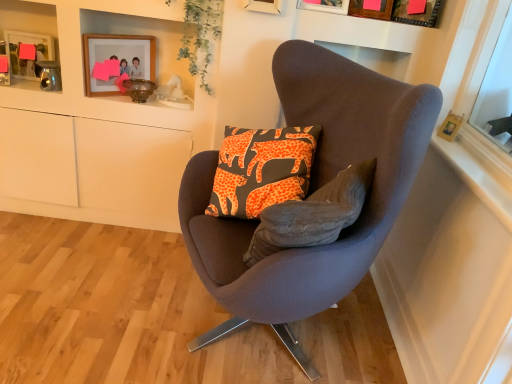
Question: Is brushed metal picture frame at upper left, which appears as the fifth picture frame when viewed from the right, next to suede-like brown chair at center and touching it?

Choices:
 (A) no
 (B) yes

Answer: (A)

Question: Considering the relative sizes of brushed metal picture frame at upper left, acting as the first picture frame starting from the left, and suede-like brown chair at center in the image provided, is brushed metal picture frame at upper left, acting as the first picture frame starting from the left, smaller than suede-like brown chair at center?

Choices:
 (A) yes
 (B) no

Answer: (A)

Question: Is brushed metal picture frame at upper left, which appears as the fifth picture frame when viewed from the right, taller than suede-like brown chair at center?

Choices:
 (A) no
 (B) yes

Answer: (A)

Question: Could you tell me if brushed metal picture frame at upper left, acting as the first picture frame starting from the left, is turned towards suede-like brown chair at center?

Choices:
 (A) no
 (B) yes

Answer: (A)

Question: From the image's perspective, is brushed metal picture frame at upper left, which appears as the fifth picture frame when viewed from the right, below suede-like brown chair at center?

Choices:
 (A) yes
 (B) no

Answer: (B)

Question: From their relative heights in the image, would you say wooden picture frame at upper center, the 4th picture frame positioned from the left, is taller or shorter than wooden frame at upper right?

Choices:
 (A) short
 (B) tall

Answer: (B)

Question: From a real-world perspective, is wooden picture frame at upper center, positioned as the 2th picture frame in right-to-left order, positioned above or below wooden frame at upper right?

Choices:
 (A) below
 (B) above

Answer: (B)

Question: Is point (364, 0) positioned closer to the camera than point (432, 135)?

Choices:
 (A) farther
 (B) closer

Answer: (A)

Question: Looking at the image, does wooden picture frame at upper center, positioned as the 2th picture frame in right-to-left order, seem bigger or smaller compared to wooden frame at upper right?

Choices:
 (A) big
 (B) small

Answer: (B)

Question: Does point (510, 223) appear closer or farther from the camera than point (222, 220)?

Choices:
 (A) closer
 (B) farther

Answer: (A)

Question: Relative to suede-like brown chair at center, is wooden frame at upper right in front or behind?

Choices:
 (A) behind
 (B) front

Answer: (A)

Question: From the image's perspective, relative to suede-like brown chair at center, is wooden frame at upper right above or below?

Choices:
 (A) below
 (B) above

Answer: (B)

Question: From a real-world perspective, is wooden frame at upper right physically located above or below suede-like brown chair at center?

Choices:
 (A) below
 (B) above

Answer: (B)

Question: Based on their sizes in the image, would you say brushed metal picture frame at upper left, acting as the first picture frame starting from the left, is bigger or smaller than green leafy plant at upper center?

Choices:
 (A) small
 (B) big

Answer: (A)

Question: Does point (6, 57) appear closer or farther from the camera than point (197, 28)?

Choices:
 (A) farther
 (B) closer

Answer: (A)